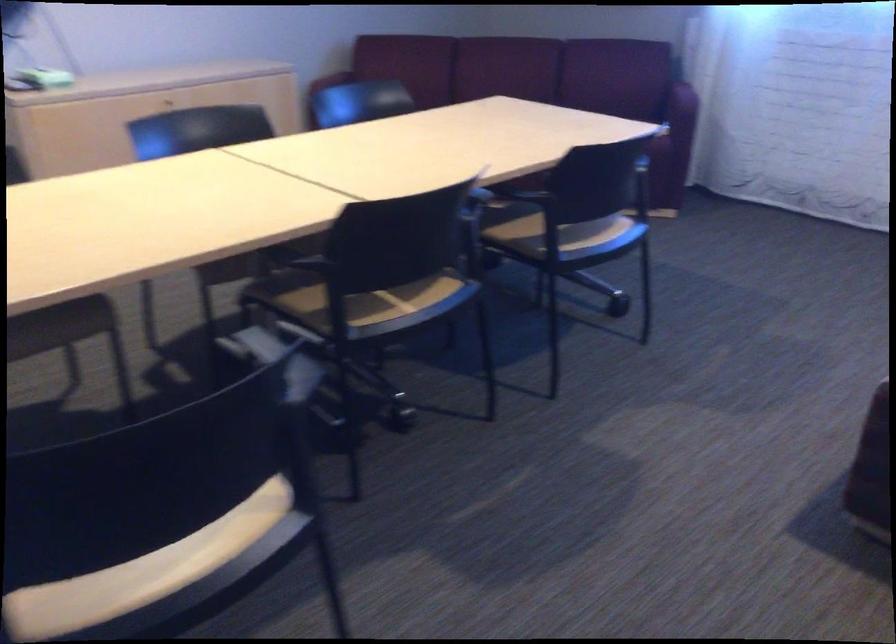
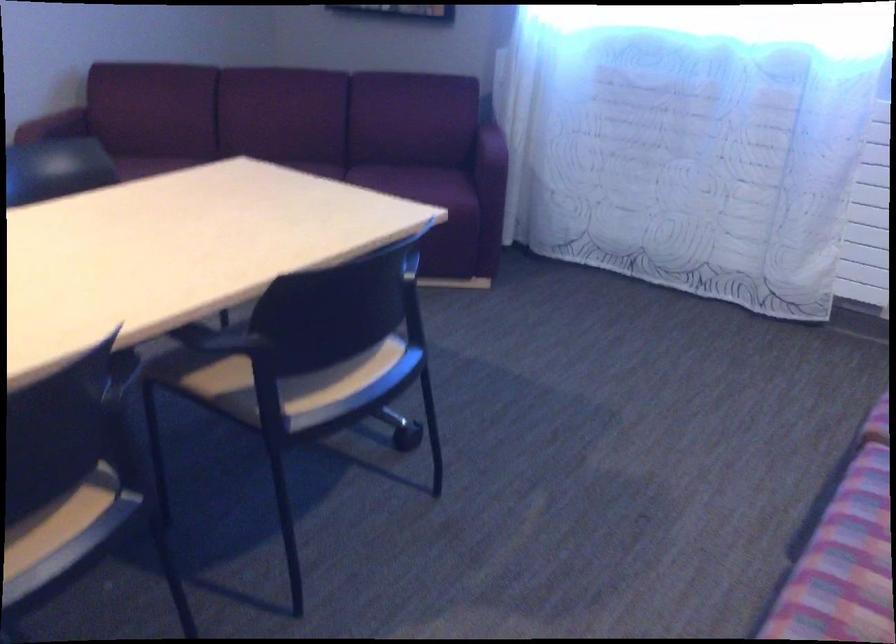
Find the pixel in the second image that matches (x=589, y=236) in the first image.

(328, 382)